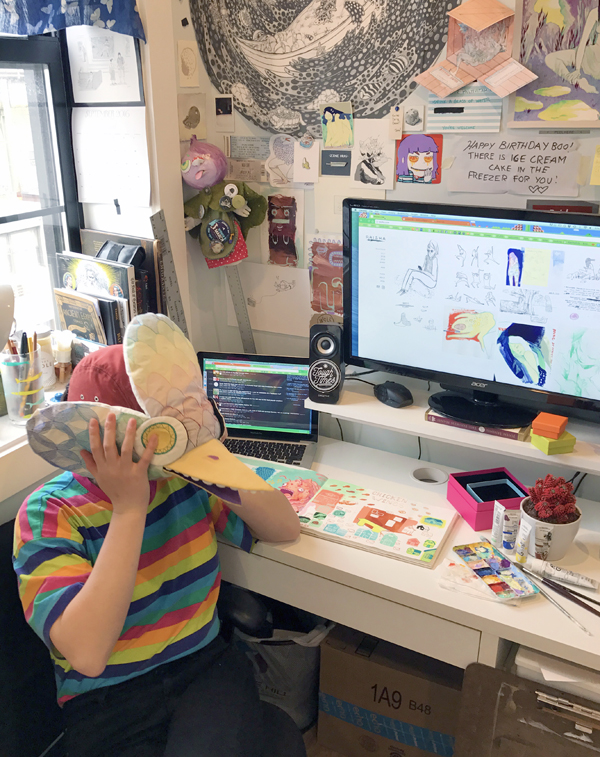
Identify the location of boxes. The width and height of the screenshot is (600, 757). (482, 503).